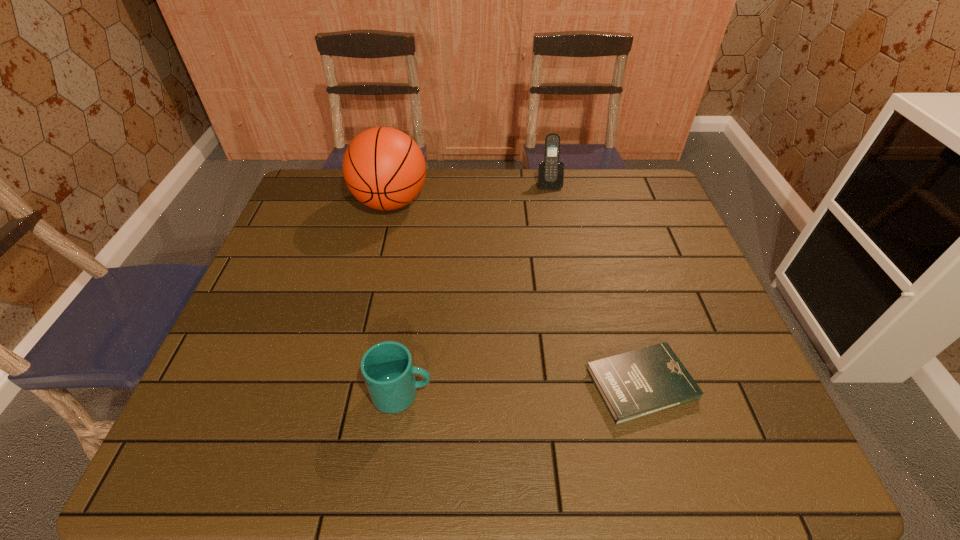
This screenshot has width=960, height=540. Identify the location of object that is at the right edge. (645, 381).

In the image, there is a desktop. In order to click on free space at the far edge in this screenshot , I will do [518, 184].

This screenshot has width=960, height=540. I want to click on free spot at the near edge of the desktop, so click(538, 428).

Locate an element on the screen. This screenshot has height=540, width=960. blank space at the left edge is located at coordinates (298, 304).

In order to click on free space at the right edge of the desktop in this screenshot , I will do `click(714, 329)`.

In the image, there is a desktop. Find the location of `vacant space at the far left corner`. vacant space at the far left corner is located at coordinates (325, 173).

Identify the location of free space between the tallest object and the cup. This screenshot has width=960, height=540. (396, 298).

You are a GUI agent. You are given a task and a screenshot of the screen. Output one action in this format:
    pyautogui.click(x=<x>, y=<y>)
    Task: Click on the vacant area between the third tallest object and the basketball
    
    Given the screenshot: What is the action you would take?
    pyautogui.click(x=396, y=298)

I want to click on vacant space that's between the cellular telephone and the cup, so click(x=475, y=288).

Where is `vacant space that is in between the shortest object and the second tallest object`? Image resolution: width=960 pixels, height=540 pixels. vacant space that is in between the shortest object and the second tallest object is located at coordinates (595, 284).